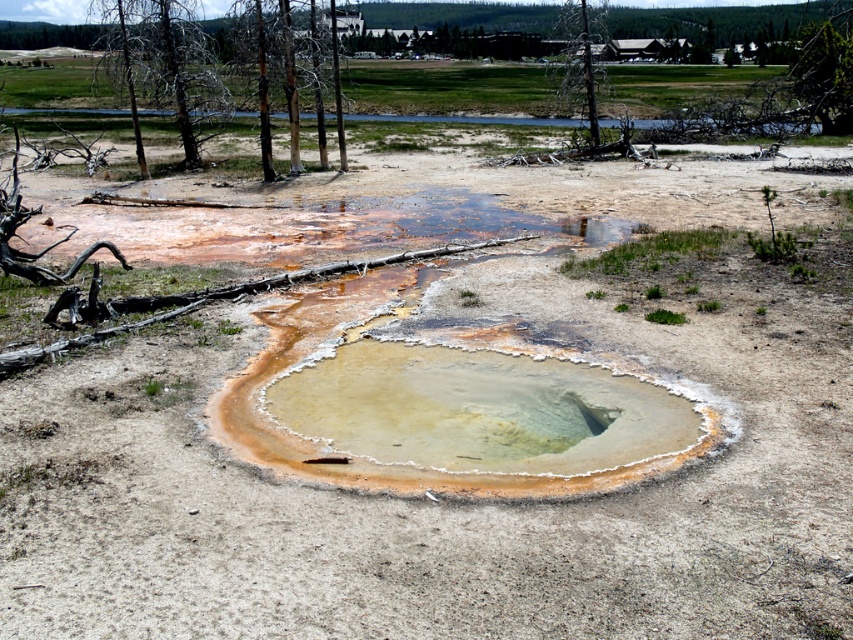
You are standing at the center of the geothermal feature in the image. You see two points marked on the ground. The first point is at coordinate point(x=190, y=44), and the second point is at coordinate point(x=827, y=20). Which point is closer to you?

Point(x=190, y=44) is in front of point(x=827, y=20), so it is closer to you.

You are a hiker trying to navigate between the brown bark tree at upper center and the green leafy tree at upper right. Which tree would you choose to use as a landmark if you want a wider reference point?

The brown bark tree at upper center has a larger width than the green leafy tree at upper right, so it would be a better landmark for a wider reference point.

You are a hiker trying to navigate through the area. You see the brown bark tree at upper left and the brown bark tree at upper center in the background. Which tree has a wider trunk?

The brown bark tree at upper left has a wider trunk than the brown bark tree at upper center.